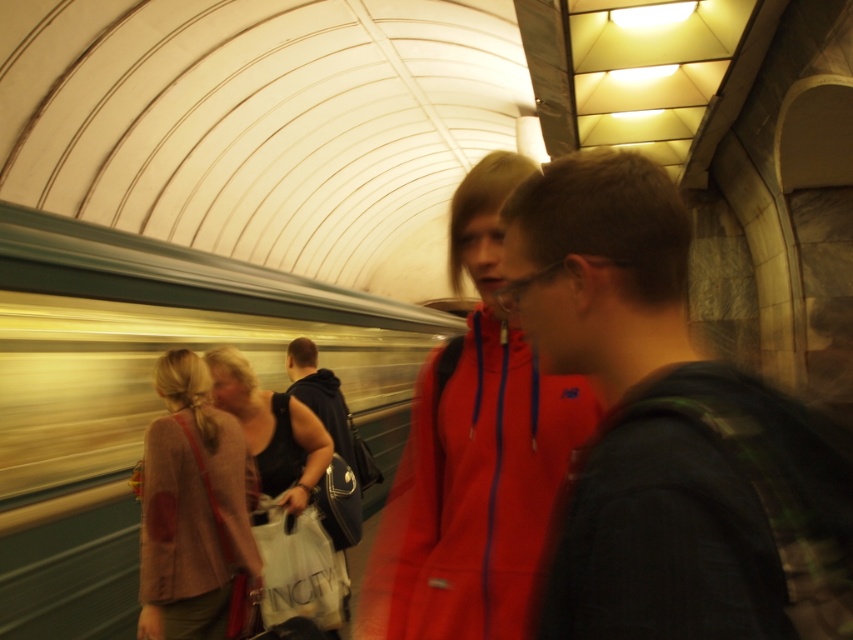
Question: Considering the real-world distances, which object is closest to the dark gray backpack at center?

Choices:
 (A) matte red jacket at center
 (B) matte black bag at center
 (C) light brown fabric jacket at lower left

Answer: (A)

Question: Which object appears farthest from the camera in this image?

Choices:
 (A) dark gray fabric backpack at center
 (B) matte black bag at center
 (C) matte red jacket at center
 (D) light brown fabric jacket at lower left

Answer: (A)

Question: Which object is farther from the camera taking this photo?

Choices:
 (A) matte black bag at center
 (B) matte red jacket at center

Answer: (A)

Question: Is light brown fabric jacket at lower left behind matte black bag at center?

Choices:
 (A) no
 (B) yes

Answer: (A)

Question: Can you confirm if matte red jacket at center is thinner than dark gray fabric backpack at center?

Choices:
 (A) yes
 (B) no

Answer: (A)

Question: Can you confirm if light brown fabric jacket at lower left is wider than dark gray fabric backpack at center?

Choices:
 (A) yes
 (B) no

Answer: (B)